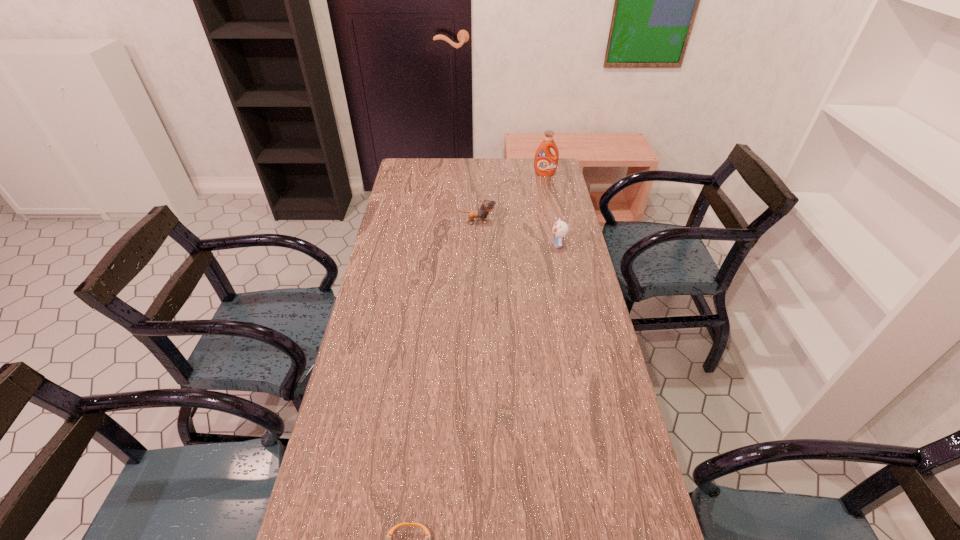
Find the location of `free point between the farther kitten and the nearer kitten`. free point between the farther kitten and the nearer kitten is located at coordinates (517, 233).

In order to click on vacant area that lies between the farthest object and the left kitten in this screenshot , I will do `click(511, 198)`.

Where is `empty location between the third object from right to left and the nearer kitten`? empty location between the third object from right to left and the nearer kitten is located at coordinates (517, 233).

You are a GUI agent. You are given a task and a screenshot of the screen. Output one action in this format:
    pyautogui.click(x=<x>, y=<y>)
    Task: Click on the object that can be found as the closest to the tallest object
    
    Given the screenshot: What is the action you would take?
    pyautogui.click(x=487, y=206)

Select which object appears as the closest to the third farthest object. Please provide its 2D coordinates. Your answer should be formatted as a tuple, i.e. [(x, y)], where the tuple contains the x and y coordinates of a point satisfying the conditions above.

[(487, 206)]

Identify the location of vacant area that satisfies the following two spatial constraints: 1. on the front-facing side of the detergent; 2. on the front-facing side of the farther kitten. (555, 222).